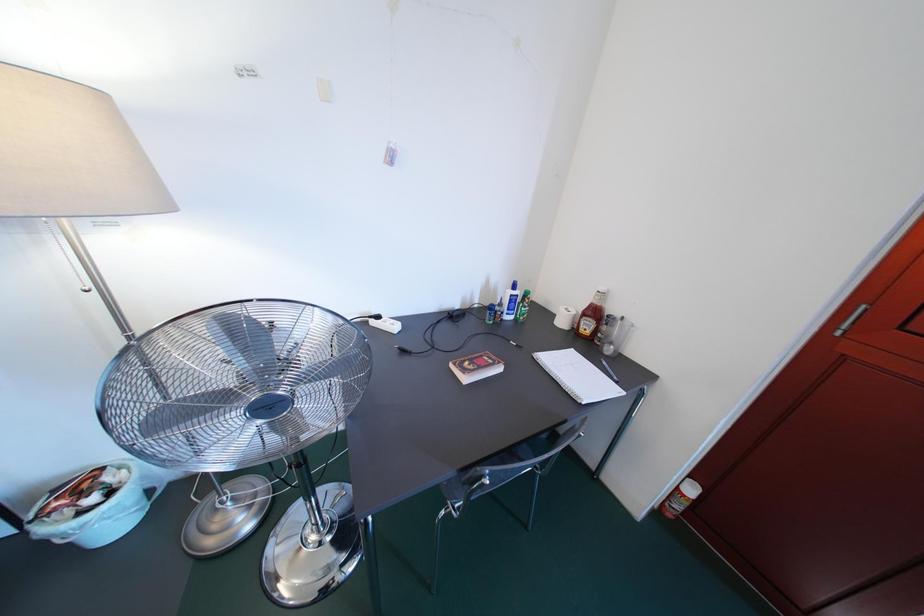
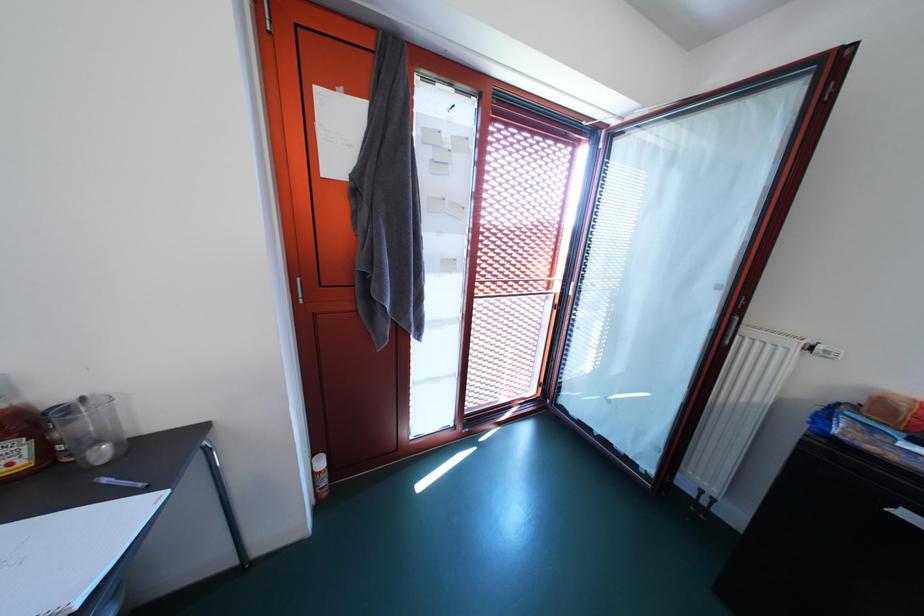
The first image is from the beginning of the video and the second image is from the end. How did the camera likely rotate when shooting the video?

The camera's rotation is toward right-down.